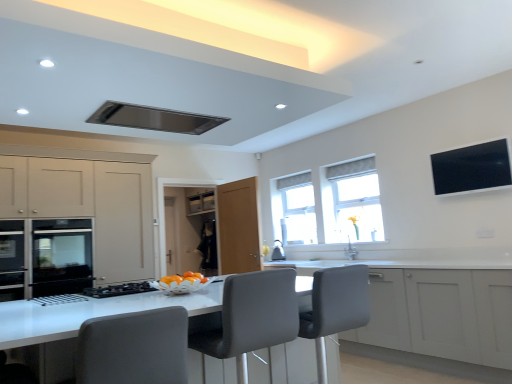
What is the approximate width of matte beige cabinet at left, arranged as the 2th cabinetry when viewed from the right?

25.89 inches.

What do you see at coordinates (134, 348) in the screenshot?
I see `gray fabric swivel chair at center, the second swivel chair from the right` at bounding box center [134, 348].

Measure the distance between black glossy tv at upper right and camera.

black glossy tv at upper right and camera are 11.75 feet apart.

Measure the distance between transparent glass window at center, which is counted as the 1th window, starting from the left, and camera.

They are 5.50 meters apart.

This screenshot has width=512, height=384. What do you see at coordinates (12, 260) in the screenshot?
I see `matte black oven at left` at bounding box center [12, 260].

Measure the distance between point (344,176) and camera.

The distance of point (344,176) from camera is 5.20 meters.

In order to click on white glossy counter at center in this screenshot , I will do `click(434, 310)`.

Identify the location of matte beige cabinet at left, arranged as the 2th cabinetry when viewed from the right. (73, 225).

From a real-world perspective, is black glossy tv at upper right positioned above or below white matte cabinet at center, acting as the second cabinetry starting from the left?

Clearly, from a real-world perspective, black glossy tv at upper right is above white matte cabinet at center, acting as the second cabinetry starting from the left.

Is black glossy tv at upper right in front of or behind white matte cabinet at center, which appears as the 1th cabinetry when viewed from the right, in the image?

Clearly, black glossy tv at upper right is behind white matte cabinet at center, which appears as the 1th cabinetry when viewed from the right.

From the image's perspective, which one is positioned lower, black glossy tv at upper right or white matte cabinet at center, which appears as the 1th cabinetry when viewed from the right?

white matte cabinet at center, which appears as the 1th cabinetry when viewed from the right.

Is the surface of matte black oven at left in direct contact with stainless steel oven at left?

There is a gap between matte black oven at left and stainless steel oven at left.

In terms of height, does matte black oven at left look taller or shorter compared to stainless steel oven at left?

matte black oven at left is shorter than stainless steel oven at left.

Which of these two, matte black oven at left or stainless steel oven at left, is bigger?

With larger size is stainless steel oven at left.

Can you confirm if matte black oven at left is positioned to the left of stainless steel oven at left?

Correct, you'll find matte black oven at left to the left of stainless steel oven at left.

Considering the points (41, 225) and (301, 181), which point is in front, point (41, 225) or point (301, 181)?

Positioned in front is point (41, 225).

Can we say matte beige cabinet at left, arranged as the 2th cabinetry when viewed from the right, lies outside transparent glass window at center, acting as the first window starting from the back?

Absolutely, matte beige cabinet at left, arranged as the 2th cabinetry when viewed from the right, is external to transparent glass window at center, acting as the first window starting from the back.

Consider the image. Considering the relative sizes of matte beige cabinet at left, the 1th cabinetry from the left, and transparent glass window at center, the second window when ordered from right to left, in the image provided, is matte beige cabinet at left, the 1th cabinetry from the left, shorter than transparent glass window at center, the second window when ordered from right to left,?

In fact, matte beige cabinet at left, the 1th cabinetry from the left, may be taller than transparent glass window at center, the second window when ordered from right to left.

Is matte beige cabinet at left, the 1th cabinetry from the left, turned away from transparent glass window at center, which is the 2th window from front to back?

No, transparent glass window at center, which is the 2th window from front to back, is not at the back of matte beige cabinet at left, the 1th cabinetry from the left.

How far apart are transparent glass window at center, which is the 2th window from front to back, and white fabric window at upper right, marked as the 2th window in a back-to-front arrangement?

They are 50.61 centimeters apart.

From the image's perspective, which object appears higher, transparent glass window at center, which is counted as the 1th window, starting from the left, or white fabric window at upper right, marked as the 2th window in a back-to-front arrangement?

white fabric window at upper right, marked as the 2th window in a back-to-front arrangement.

Who is smaller, transparent glass window at center, acting as the first window starting from the back, or white fabric window at upper right, marked as the 1th window in a front-to-back arrangement?

transparent glass window at center, acting as the first window starting from the back.

From a real-world perspective, does transparent glass window at center, the second window when ordered from right to left, stand above white fabric window at upper right, marked as the 2th window in a back-to-front arrangement?

No, from a real-world perspective, transparent glass window at center, the second window when ordered from right to left, is not on top of white fabric window at upper right, marked as the 2th window in a back-to-front arrangement.

Which object is thinner, grey fabric swivel chair at center, marked as the 2th swivel chair in a left-to-right arrangement, or grey fabric chair at center?

With smaller width is grey fabric chair at center.

Consider the image. Which object is closer to the camera, grey fabric swivel chair at center, marked as the 1th swivel chair in a right-to-left arrangement, or grey fabric chair at center?

grey fabric chair at center is in front.

Does point (313, 322) come in front of point (251, 308)?

No, it is behind (251, 308).

Who is shorter, grey fabric swivel chair at center, acting as the first swivel chair starting from the back, or grey fabric chair at center?

With less height is grey fabric chair at center.

Can we say grey fabric chair at center lies outside gray fabric swivel chair at center, the second swivel chair from the right?

Yes, grey fabric chair at center is outside of gray fabric swivel chair at center, the second swivel chair from the right.

Where is `chair that is below the gray fabric swivel chair at center, the second swivel chair from the right (from the image's perspective)`? The height and width of the screenshot is (384, 512). chair that is below the gray fabric swivel chair at center, the second swivel chair from the right (from the image's perspective) is located at coordinates (251, 318).

From a real-world perspective, does grey fabric chair at center stand above gray fabric swivel chair at center, marked as the 2th swivel chair in a back-to-front arrangement?

No, from a real-world perspective, grey fabric chair at center is not over gray fabric swivel chair at center, marked as the 2th swivel chair in a back-to-front arrangement

What's the angular difference between transparent glass window at center, which is counted as the 1th window, starting from the left, and white matte cabinet at center, acting as the second cabinetry starting from the left,'s facing directions?

There is a 0.778-degree angle between the facing directions of transparent glass window at center, which is counted as the 1th window, starting from the left, and white matte cabinet at center, acting as the second cabinetry starting from the left.

Does transparent glass window at center, acting as the first window starting from the back, have a greater height compared to white matte cabinet at center, which appears as the 1th cabinetry when viewed from the right?

No, transparent glass window at center, acting as the first window starting from the back, is not taller than white matte cabinet at center, which appears as the 1th cabinetry when viewed from the right.

From the image's perspective, does transparent glass window at center, which is counted as the 1th window, starting from the left, appear higher than white matte cabinet at center, which appears as the 1th cabinetry when viewed from the right?

Yes, from the image's perspective, transparent glass window at center, which is counted as the 1th window, starting from the left, is above white matte cabinet at center, which appears as the 1th cabinetry when viewed from the right.

This screenshot has height=384, width=512. What are the coordinates of `the 2nd cabinetry positioned below the black glossy tv at upper right (from a real-world perspective)` in the screenshot? It's located at (435, 307).

Locate an element on the screen. Image resolution: width=512 pixels, height=384 pixels. home appliance that is below the matte black oven at left (from the image's perspective) is located at coordinates (45, 257).

Looking at the image, which one is located closer to white matte cabinet at center, acting as the second cabinetry starting from the left, grey fabric swivel chair at center, which is counted as the 2th swivel chair, starting from the front, or stainless steel oven at left?

grey fabric swivel chair at center, which is counted as the 2th swivel chair, starting from the front, is closer to white matte cabinet at center, acting as the second cabinetry starting from the left.

Based on their spatial positions, is grey fabric swivel chair at center, which is counted as the 2th swivel chair, starting from the front, or white matte cabinet at center, acting as the second cabinetry starting from the left, closer to white glossy counter at center?

The object closer to white glossy counter at center is white matte cabinet at center, acting as the second cabinetry starting from the left.

Based on the photo, from the image, which object appears to be farther from white glossy counter at center, gray fabric swivel chair at center, placed as the first swivel chair when sorted from left to right, or grey fabric chair at center?

gray fabric swivel chair at center, placed as the first swivel chair when sorted from left to right, lies further to white glossy counter at center than the other object.

Looking at the image, which one is located further to transparent glass window at center, acting as the first window starting from the back, gray fabric swivel chair at center, marked as the 2th swivel chair in a back-to-front arrangement, or grey fabric swivel chair at center, marked as the 2th swivel chair in a left-to-right arrangement?

The object further to transparent glass window at center, acting as the first window starting from the back, is gray fabric swivel chair at center, marked as the 2th swivel chair in a back-to-front arrangement.

Considering their positions, is gray fabric swivel chair at center, placed as the first swivel chair when sorted from left to right, positioned further to transparent glass window at center, which is counted as the 1th window, starting from the left, than white matte cabinet at center, which appears as the 1th cabinetry when viewed from the right?

gray fabric swivel chair at center, placed as the first swivel chair when sorted from left to right, is further to transparent glass window at center, which is counted as the 1th window, starting from the left.

From the image, which object appears to be nearer to transparent glass window at center, the second window when ordered from right to left, grey fabric chair at center or gray fabric swivel chair at center, the second swivel chair from the right?

Among the two, grey fabric chair at center is located nearer to transparent glass window at center, the second window when ordered from right to left.

Looking at the image, which one is located closer to gray fabric swivel chair at center, placed as the first swivel chair when sorted from left to right, matte black oven at left or white matte cabinet at center, acting as the second cabinetry starting from the left?

Among the two, white matte cabinet at center, acting as the second cabinetry starting from the left, is located nearer to gray fabric swivel chair at center, placed as the first swivel chair when sorted from left to right.

Estimate the real-world distances between objects in this image. Which object is further from white glossy counter at center, white fabric window at upper right, the 1th window positioned from the right, or grey fabric chair at center?

Among the two, grey fabric chair at center is located further to white glossy counter at center.

Image resolution: width=512 pixels, height=384 pixels. In order to click on cabinetry located between gray fabric swivel chair at center, marked as the 2th swivel chair in a back-to-front arrangement, and black glossy tv at upper right in the left-right direction in this screenshot , I will do `click(435, 307)`.

At what (x,y) coordinates should I click in order to perform the action: click on home appliance between satin metallic exhaust hood at upper center and transparent glass window at center, which is counted as the 1th window, starting from the left, in the front-back direction. Please return your answer as a coordinate pair (x, y). Looking at the image, I should click on (45, 257).

This screenshot has width=512, height=384. Find the location of `window screen located between gray fabric swivel chair at center, marked as the 2th swivel chair in a back-to-front arrangement, and transparent glass window at center, acting as the first window starting from the back, in the depth direction`. window screen located between gray fabric swivel chair at center, marked as the 2th swivel chair in a back-to-front arrangement, and transparent glass window at center, acting as the first window starting from the back, in the depth direction is located at coordinates (472, 168).

Locate an element on the screen. swivel chair between grey fabric chair at center and white fabric window at upper right, marked as the 2th window in a back-to-front arrangement, from front to back is located at coordinates click(x=335, y=308).